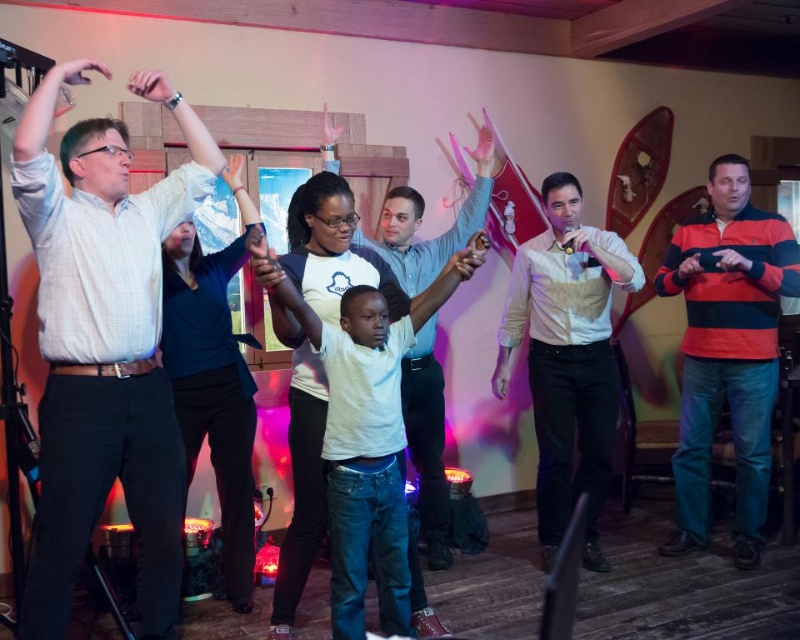
Is light blue shirt at center further to the viewer compared to white matte shirt at center?

Yes.

You are a GUI agent. You are given a task and a screenshot of the screen. Output one action in this format:
    pyautogui.click(x=<x>, y=<y>)
    Task: Click on the light blue shirt at center
    The height and width of the screenshot is (640, 800).
    Given the screenshot: What is the action you would take?
    pyautogui.click(x=428, y=444)

Between light brown textured shirt at center and white matte shirt at center, which one has more height?

light brown textured shirt at center is taller.

Image resolution: width=800 pixels, height=640 pixels. Describe the element at coordinates (568, 358) in the screenshot. I see `light brown textured shirt at center` at that location.

Does point (517, 284) come behind point (404, 433)?

Yes.

Where is `light brown textured shirt at center`? Image resolution: width=800 pixels, height=640 pixels. light brown textured shirt at center is located at coordinates (568, 358).

Which is above, white shirt at left or striped cotton sweater at right?

Positioned higher is white shirt at left.

Can you confirm if white shirt at left is shorter than striped cotton sweater at right?

Indeed, white shirt at left has a lesser height compared to striped cotton sweater at right.

The width and height of the screenshot is (800, 640). What do you see at coordinates (104, 344) in the screenshot? I see `white shirt at left` at bounding box center [104, 344].

The image size is (800, 640). I want to click on white shirt at left, so click(104, 344).